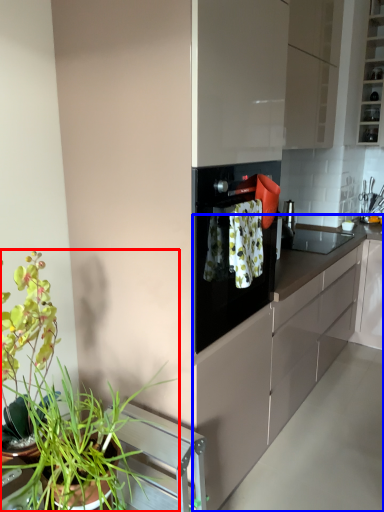
Question: Among these objects, which one is farthest to the camera, houseplant (highlighted by a red box) or countertop (highlighted by a blue box)?

Choices:
 (A) houseplant
 (B) countertop

Answer: (B)